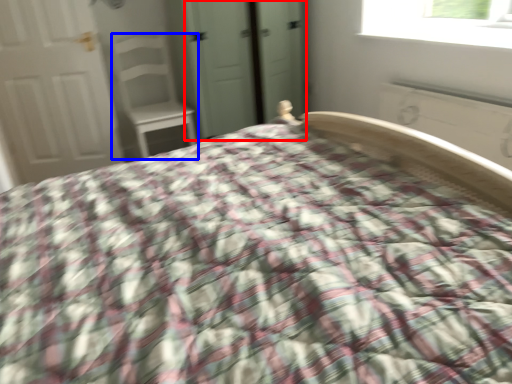
Question: Which object appears closest to the camera in this image, screen door (highlighted by a red box) or chair (highlighted by a blue box)?

Choices:
 (A) screen door
 (B) chair

Answer: (A)